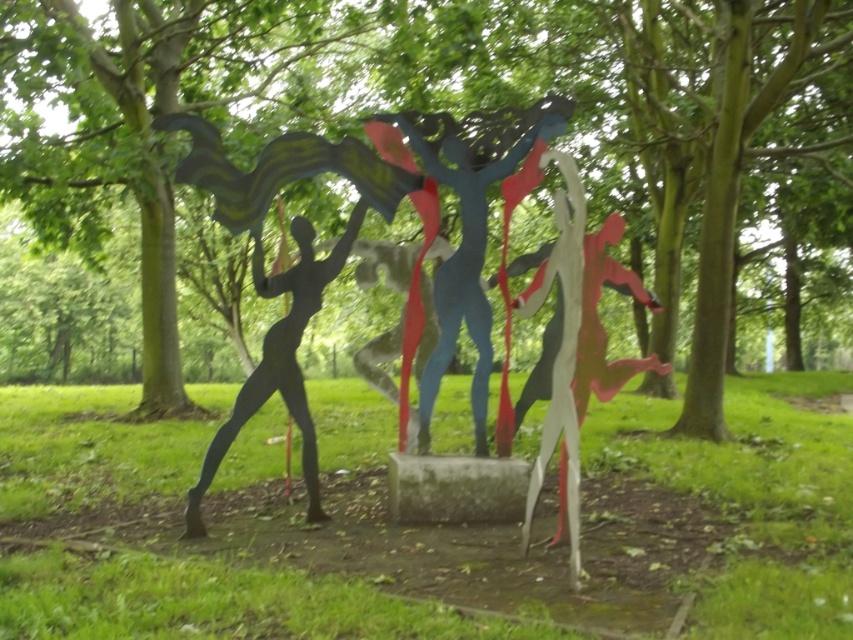
Question: Is green leafy tree at center bigger than matte black figure at center?

Choices:
 (A) no
 (B) yes

Answer: (B)

Question: Is green matte tree at center wider than metallic blue figure at center?

Choices:
 (A) yes
 (B) no

Answer: (B)

Question: Which of the following is the farthest from the observer?

Choices:
 (A) (32, 170)
 (B) (186, 618)

Answer: (A)

Question: Which point appears farthest from the camera in this image?

Choices:
 (A) (456, 577)
 (B) (647, 154)
 (C) (479, 138)
 (D) (166, 100)

Answer: (B)

Question: Can you confirm if metallic silver figure at center is bigger than matte black figure at center?

Choices:
 (A) no
 (B) yes

Answer: (B)

Question: Which point is farther to the camera?

Choices:
 (A) metallic silver figure at center
 (B) matte black figure at center
 (C) metallic blue figure at center
 (D) green matte tree at center

Answer: (D)